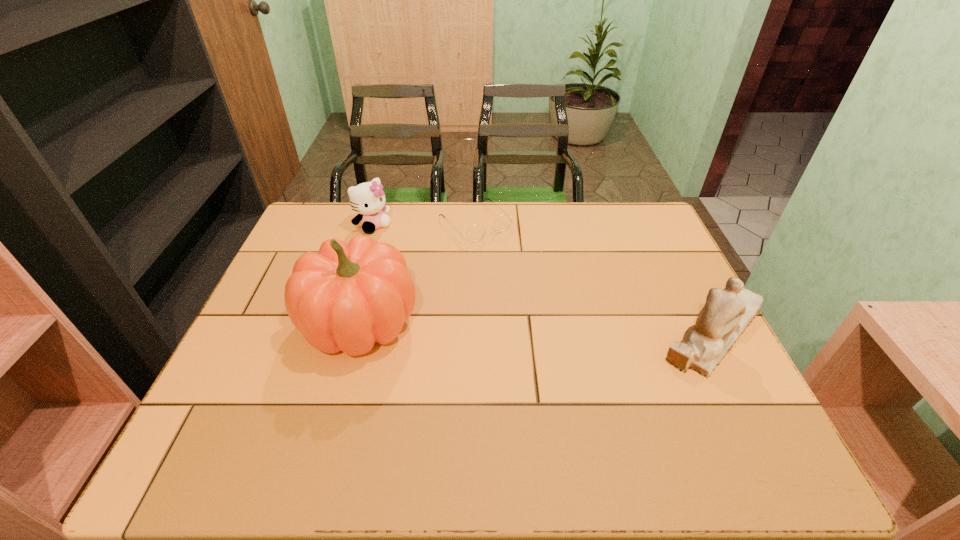
Locate an element on the screen. This screenshot has width=960, height=540. vacant space located 0.300m on the front-facing side of the kitten is located at coordinates (438, 284).

Where is `free region located on the front-facing side of the kitten`? The image size is (960, 540). free region located on the front-facing side of the kitten is located at coordinates (423, 271).

Identify the location of spectacles at the far edge. (474, 234).

Locate an element on the screen. kitten at the far edge is located at coordinates (368, 199).

This screenshot has width=960, height=540. I want to click on object that is positioned at the left edge, so click(345, 298).

Where is `object present at the right edge`? The width and height of the screenshot is (960, 540). object present at the right edge is located at coordinates (727, 312).

You are a GUI agent. You are given a task and a screenshot of the screen. Output one action in this format:
    pyautogui.click(x=<x>, y=<y>)
    Task: Click on the vacant space at the far edge of the desktop
    
    Given the screenshot: What is the action you would take?
    pyautogui.click(x=487, y=220)

Locate an element on the screen. vacant area at the near edge of the desktop is located at coordinates (501, 402).

This screenshot has height=540, width=960. In order to click on free space at the left edge in this screenshot , I will do `click(273, 320)`.

In the image, there is a desktop. Where is `free space at the right edge`? The width and height of the screenshot is (960, 540). free space at the right edge is located at coordinates (666, 298).